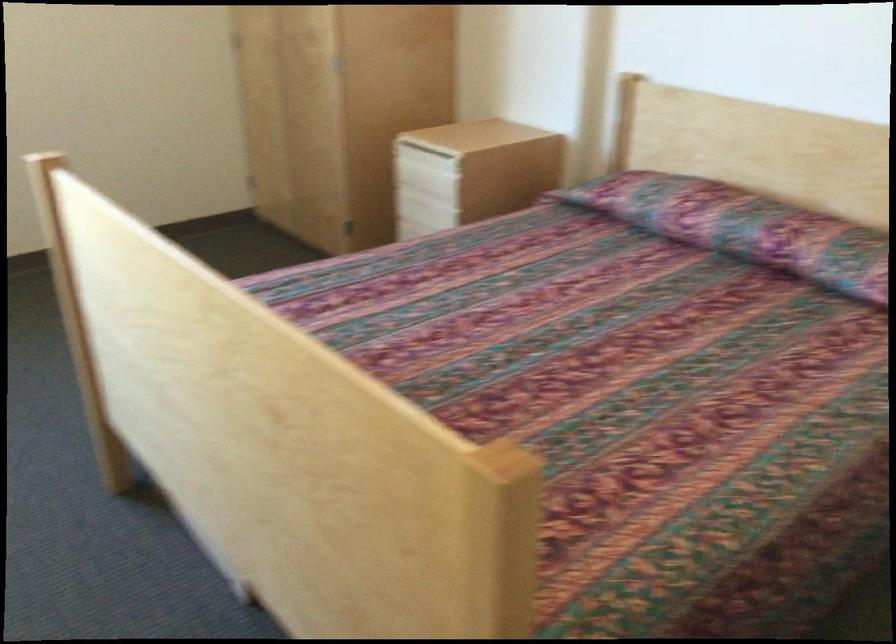
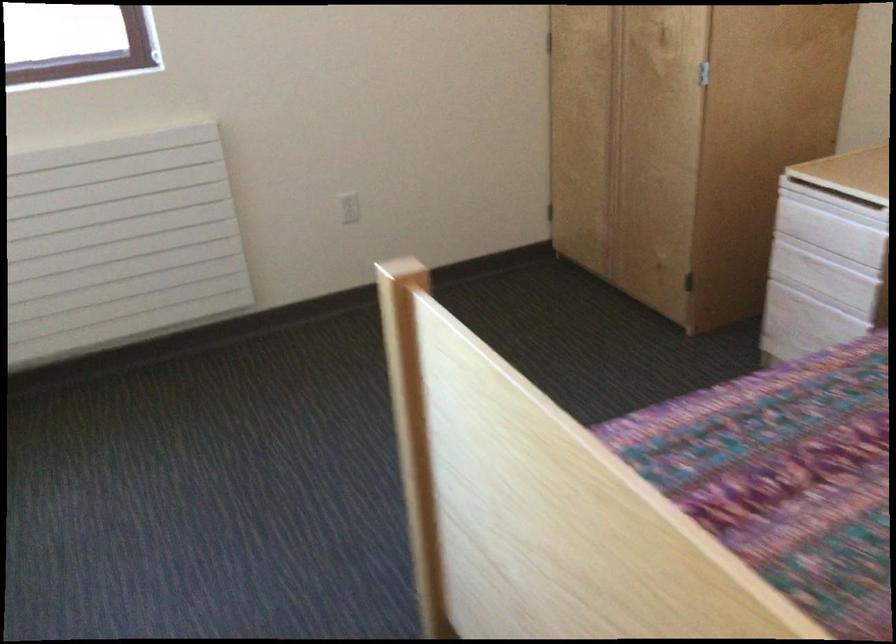
Question: How did the camera likely rotate?

Choices:
 (A) Left
 (B) Right
 (C) Up
 (D) Down

Answer: (A)